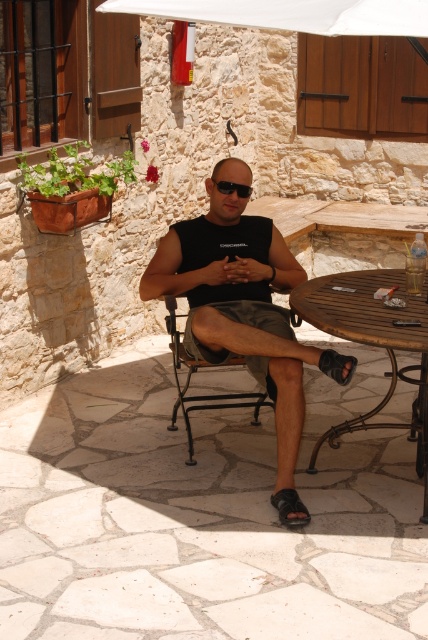
Between black matte tank top at center and gray cotton shorts at center, which one is positioned lower?

black matte tank top at center is lower down.

Who is taller, black matte tank top at center or gray cotton shorts at center?

Standing taller between the two is black matte tank top at center.

The image size is (428, 640). Describe the element at coordinates (241, 307) in the screenshot. I see `black matte tank top at center` at that location.

The image size is (428, 640). What are the coordinates of `black matte tank top at center` in the screenshot? It's located at (241, 307).

Does black matte tank top at center have a larger size compared to wooden table at center?

Yes.

Is point (193, 236) behind point (329, 323)?

Yes.

Is point (255, 378) closer to viewer compared to point (350, 326)?

No, it is behind (350, 326).

The width and height of the screenshot is (428, 640). I want to click on black matte tank top at center, so click(x=241, y=307).

Does wooden table at center have a greater height compared to black leather sandal at lower center?

Yes.

From the picture: Can you confirm if wooden table at center is shorter than black leather sandal at lower center?

No.

I want to click on wooden table at center, so click(372, 342).